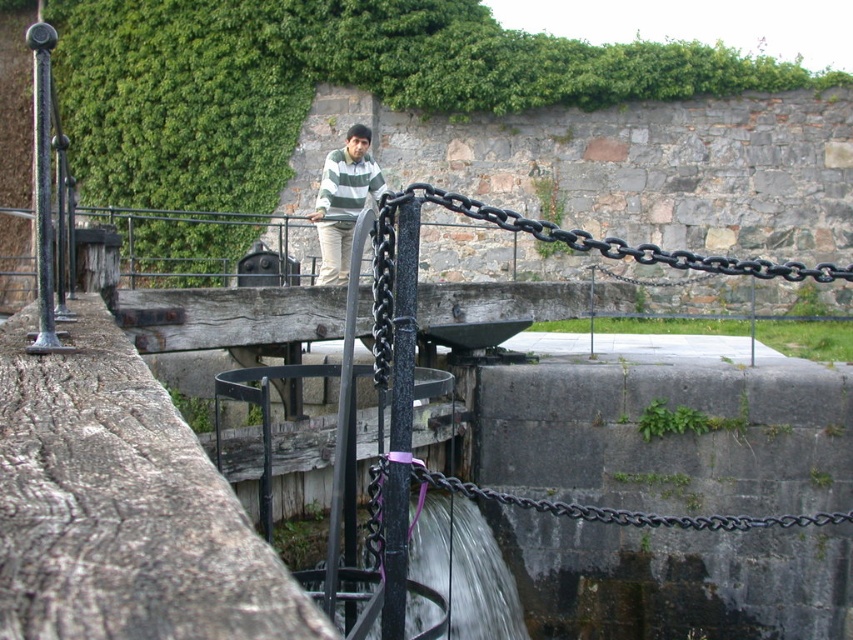
You are standing on the wooden platform and want to secure a package to the black metal chain at upper center. What are the exact coordinates where you should attach it?

The black metal chain at upper center is located at coordinates point (624,243).

You are a tailor observing the striped sweater at center and the black metal chain at lower center. Which object has a smaller width when viewed from above?

The striped sweater at center is thinner than the black metal chain at lower center, so the striped sweater at center has a smaller width when viewed from above.